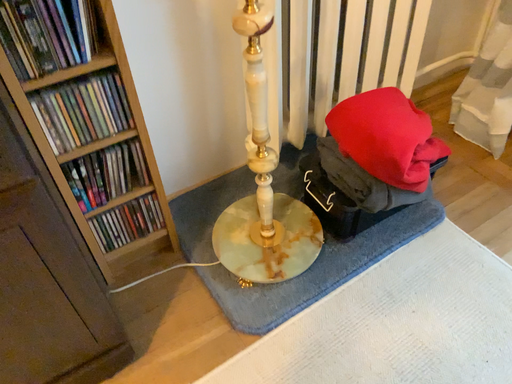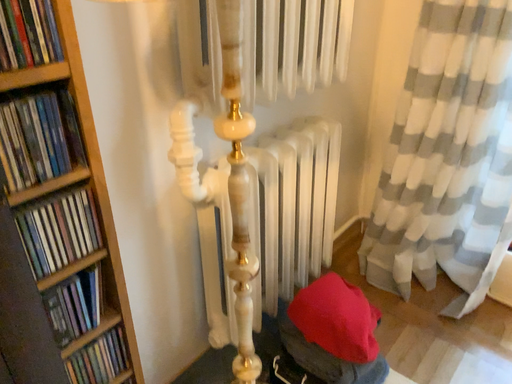
Question: Which way did the camera rotate in the video?

Choices:
 (A) rotated right
 (B) rotated left

Answer: (A)